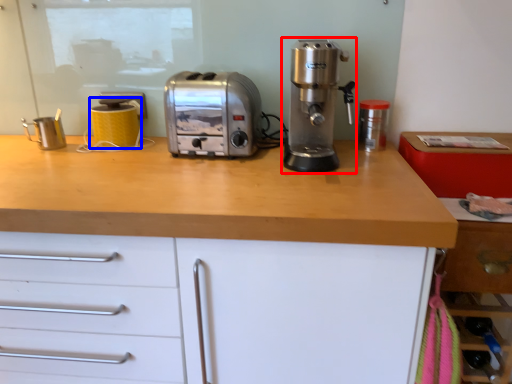
Question: Which object is further to the camera taking this photo, coffee machine (highlighted by a red box) or kitchen appliance (highlighted by a blue box)?

Choices:
 (A) coffee machine
 (B) kitchen appliance

Answer: (B)